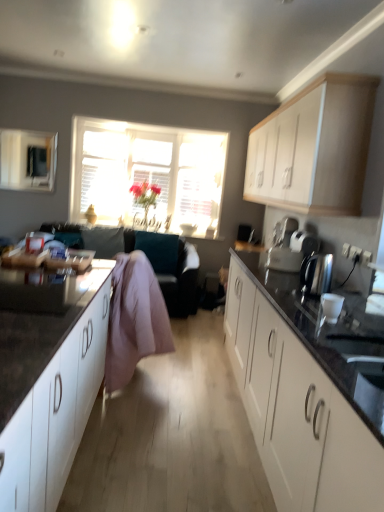
Question: From the image's perspective, is white matte cabinet at lower left, placed as the 3th cabinetry when sorted from right to left, on top of satin silver toaster at upper right?

Choices:
 (A) no
 (B) yes

Answer: (A)

Question: Is white matte cabinet at lower left, placed as the 3th cabinetry when sorted from right to left, completely or partially outside of satin silver toaster at upper right?

Choices:
 (A) yes
 (B) no

Answer: (A)

Question: From a real-world perspective, is white matte cabinet at lower left, which ranks as the 1th cabinetry in left-to-right order, below satin silver toaster at upper right?

Choices:
 (A) yes
 (B) no

Answer: (A)

Question: Does white matte cabinet at lower left, which ranks as the 1th cabinetry in left-to-right order, contain satin silver toaster at upper right?

Choices:
 (A) yes
 (B) no

Answer: (B)

Question: Are white matte cabinet at lower left, which ranks as the 1th cabinetry in left-to-right order, and satin silver toaster at upper right making contact?

Choices:
 (A) yes
 (B) no

Answer: (B)

Question: Considering their positions, is white matte cabinet at right, the 2th cabinetry when ordered from right to left, located in front of or behind matte black microwave at upper left?

Choices:
 (A) front
 (B) behind

Answer: (A)

Question: Considering the positions of point (251, 420) and point (46, 173), is point (251, 420) closer or farther from the camera than point (46, 173)?

Choices:
 (A) closer
 (B) farther

Answer: (A)

Question: Is white matte cabinet at right, the second cabinetry in the left-to-right sequence, wider or thinner than matte black microwave at upper left?

Choices:
 (A) wide
 (B) thin

Answer: (A)

Question: From the image's perspective, is white matte cabinet at right, the second cabinetry in the left-to-right sequence, above or below matte black microwave at upper left?

Choices:
 (A) below
 (B) above

Answer: (A)

Question: From a real-world perspective, relative to pink fabric couch at center, is matte black microwave at upper left vertically above or below?

Choices:
 (A) below
 (B) above

Answer: (B)

Question: Looking at the image, does matte black microwave at upper left seem bigger or smaller compared to pink fabric couch at center?

Choices:
 (A) big
 (B) small

Answer: (B)

Question: Visually, is matte black microwave at upper left positioned to the left or to the right of pink fabric couch at center?

Choices:
 (A) left
 (B) right

Answer: (A)

Question: Is matte black microwave at upper left situated inside pink fabric couch at center or outside?

Choices:
 (A) outside
 (B) inside

Answer: (A)

Question: Is point (49, 133) closer or farther from the camera than point (360, 112)?

Choices:
 (A) farther
 (B) closer

Answer: (A)

Question: From a real-world perspective, is matte black microwave at upper left positioned above or below white matte cabinet at upper right, acting as the third cabinetry starting from the left?

Choices:
 (A) below
 (B) above

Answer: (A)